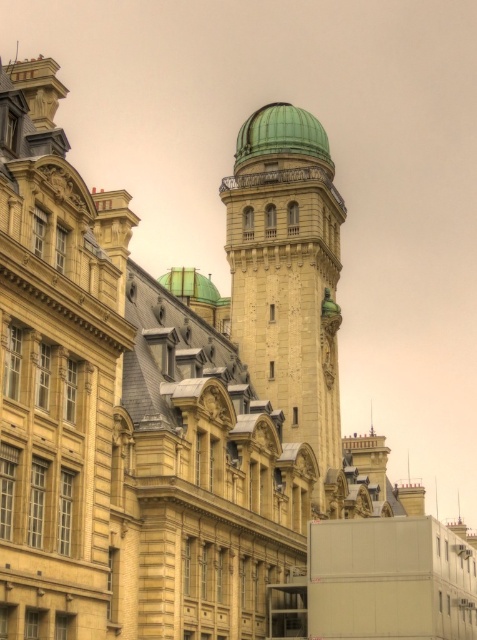
You are an architect examining the historic building. You notice two green domes in the image. Which dome is closer to you, the green dome at center or the green matte dome at upper center?

The green dome at center is closer to you because it is positioned in front of the green matte dome at upper center.

You are an architect examining the historic building. You notice two green domes in the image. The first is labeled as the green dome at center, and the second is the green polished dome at upper center. Which of these two domes is taller?

The green dome at center is much taller than the green polished dome at upper center according to the description.